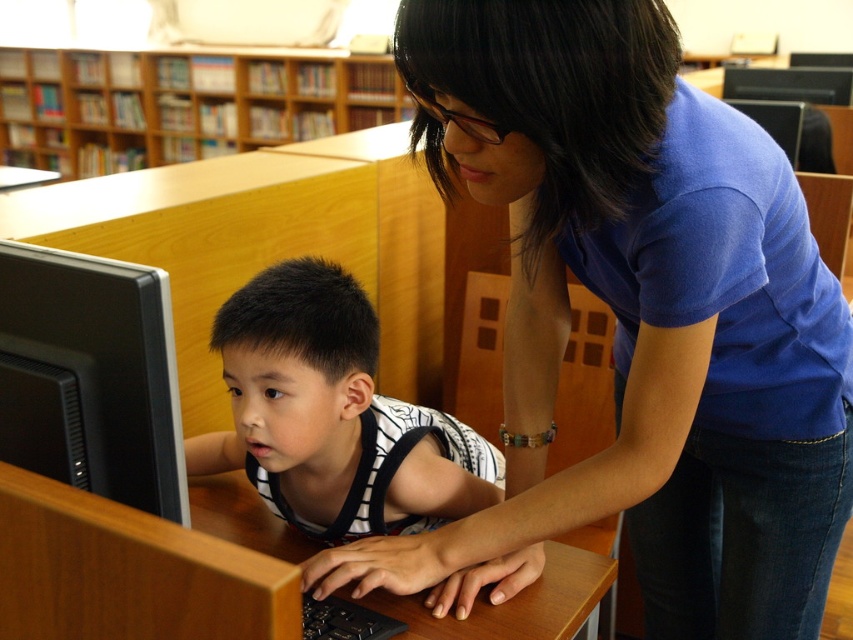
Question: Which object appears closest to the camera in this image?

Choices:
 (A) white striped shirt at center
 (B) wooden bookshelf at upper center
 (C) blue cotton shirt at upper right
 (D) black plastic monitor at lower left

Answer: (D)

Question: Is blue cotton shirt at upper right to the left of black plastic keyboard at lower center from the viewer's perspective?

Choices:
 (A) yes
 (B) no

Answer: (B)

Question: Which point appears farthest from the camera in this image?

Choices:
 (A) (224, 77)
 (B) (73, 406)

Answer: (A)

Question: Can you confirm if wooden bookshelf at upper center is positioned below black plastic keyboard at lower center?

Choices:
 (A) yes
 (B) no

Answer: (B)

Question: Does black plastic monitor at lower left have a lesser width compared to wooden bookshelf at upper center?

Choices:
 (A) no
 (B) yes

Answer: (B)

Question: Which of these objects is positioned farthest from the black plastic monitor at lower left?

Choices:
 (A) black plastic keyboard at lower center
 (B) blue cotton shirt at upper right
 (C) white striped shirt at center

Answer: (B)